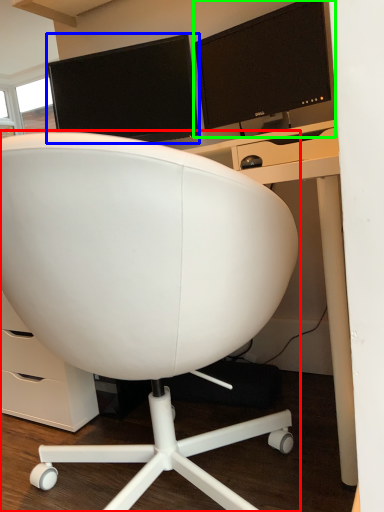
Question: Estimate the real-world distances between objects in this image. Which object is farther from chair (highlighted by a red box), computer monitor (highlighted by a blue box) or computer monitor (highlighted by a green box)?

Choices:
 (A) computer monitor
 (B) computer monitor

Answer: (A)